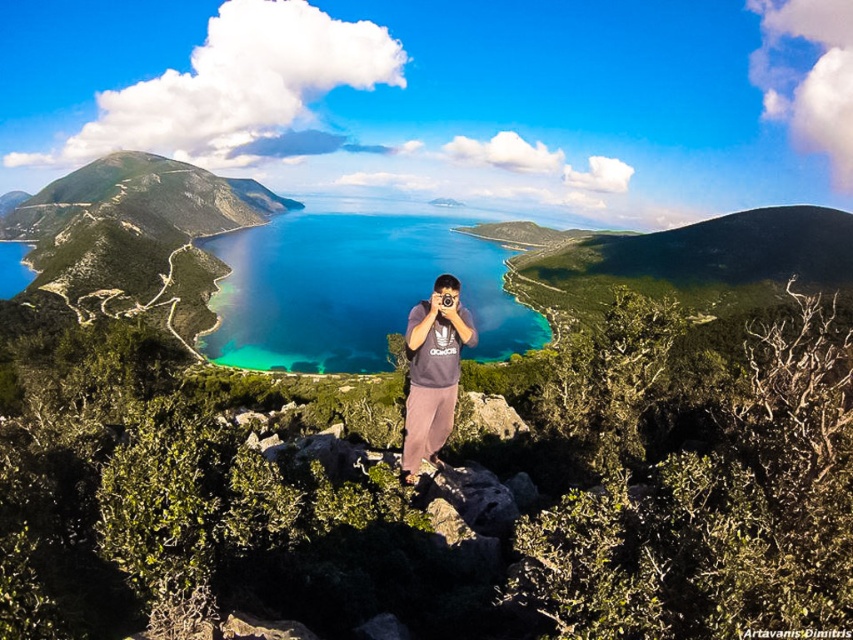
Does point (300, 276) come farther from viewer compared to point (412, 474)?

Yes, it is.

Is turquoise glossy water at center shorter than gray cotton t-shirt at center?

No.

Does point (229, 240) lie in front of point (412, 323)?

No.

Where is `turquoise glossy water at center`? turquoise glossy water at center is located at coordinates (354, 285).